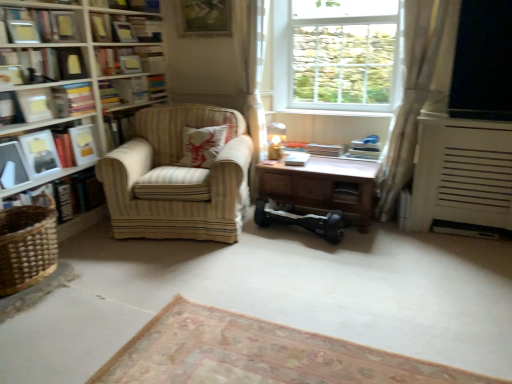
I want to click on free space between woven brown basket at lower left and carpeted floor at lower center, the 2th plain positioned from the front, so point(88,323).